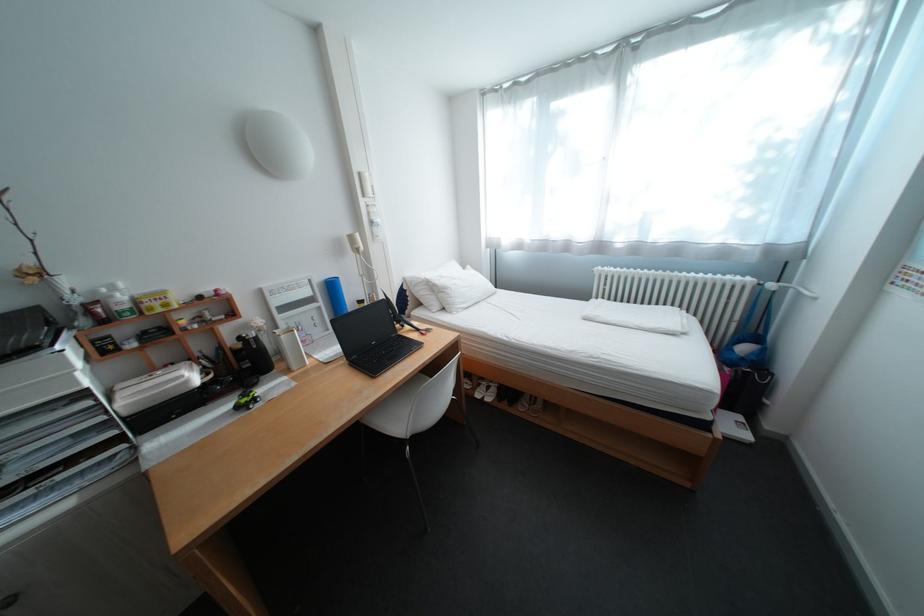
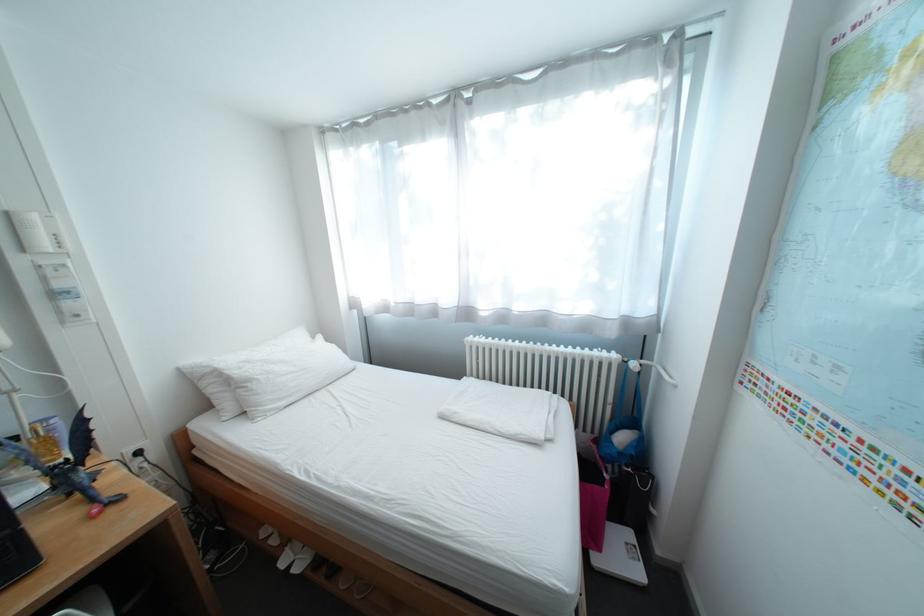
Which direction would the cameraman need to move to produce the second image?

The cameraman moved toward right, forward.